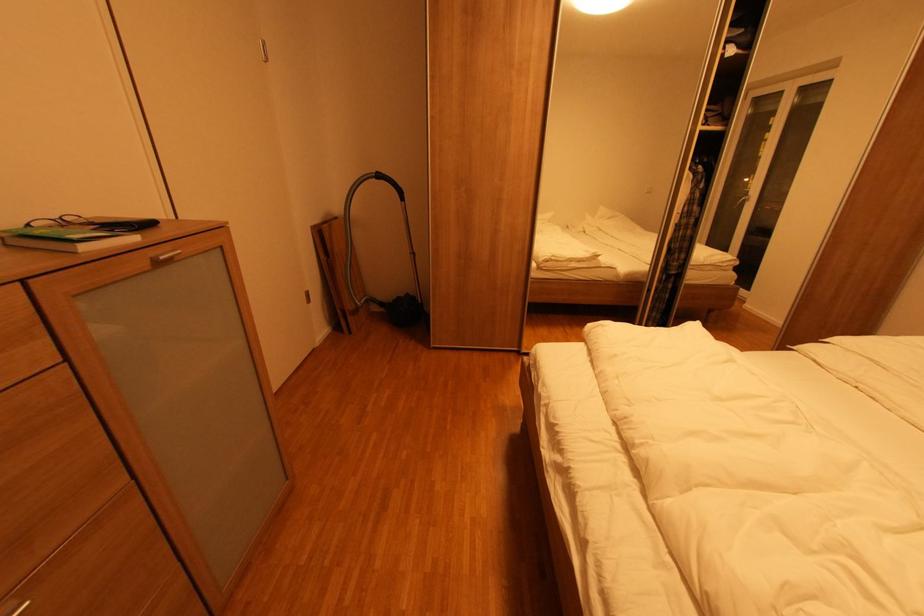
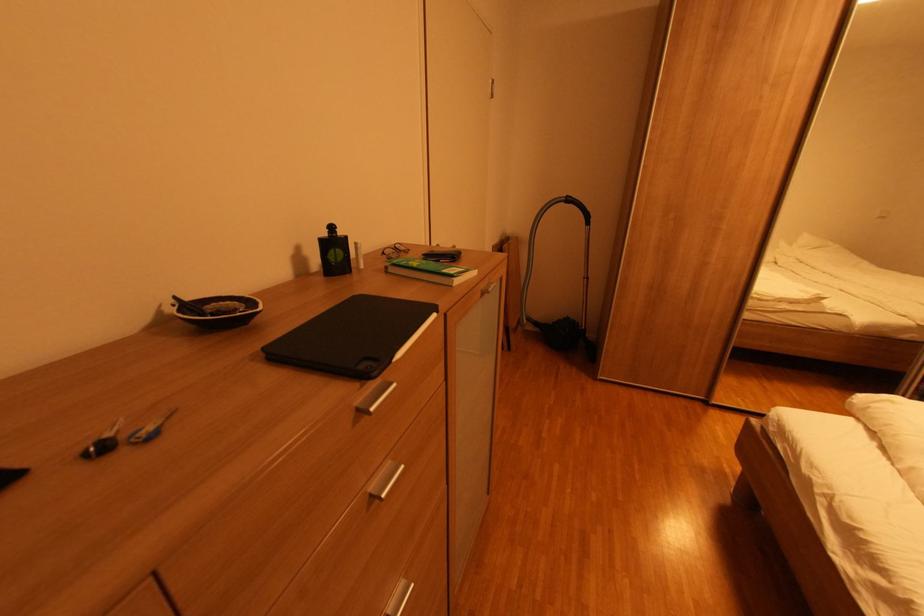
Question: The images are taken continuously from a first-person perspective. In which direction are you moving?

Choices:
 (A) Left
 (B) Right
 (C) Forward
 (D) Backward

Answer: (A)